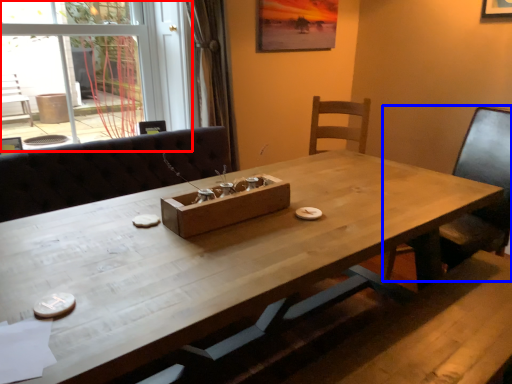
Question: Among these objects, which one is farthest to the camera, glass door (highlighted by a red box) or chair (highlighted by a blue box)?

Choices:
 (A) glass door
 (B) chair

Answer: (A)